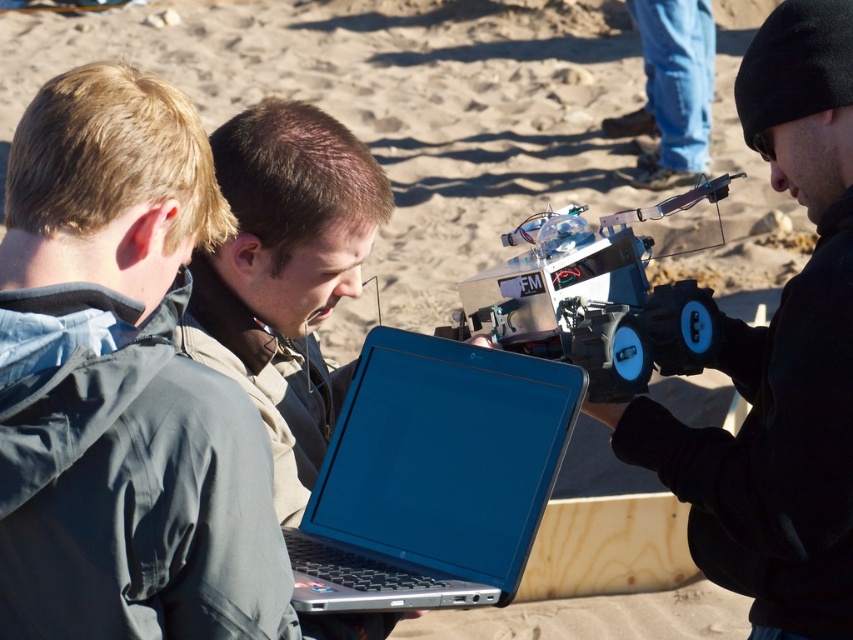
You are a drone operator trying to land a drone on the blue glossy laptop at center. The drone has a GPS coordinate of point (x=432, y=476). Is this point on the blue glossy laptop at center?

Yes, the point (x=432, y=476) is on the blue glossy laptop at center, so the drone can land there.